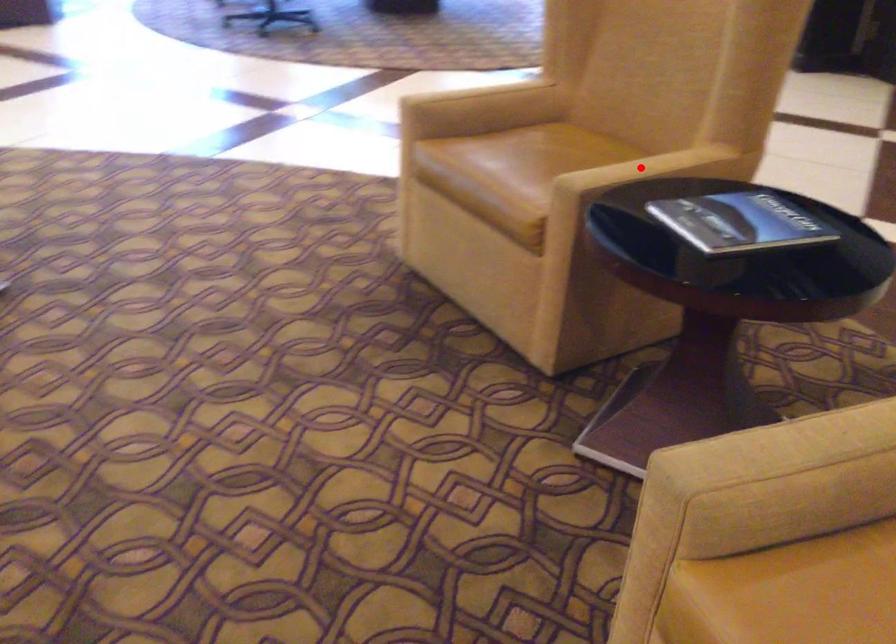
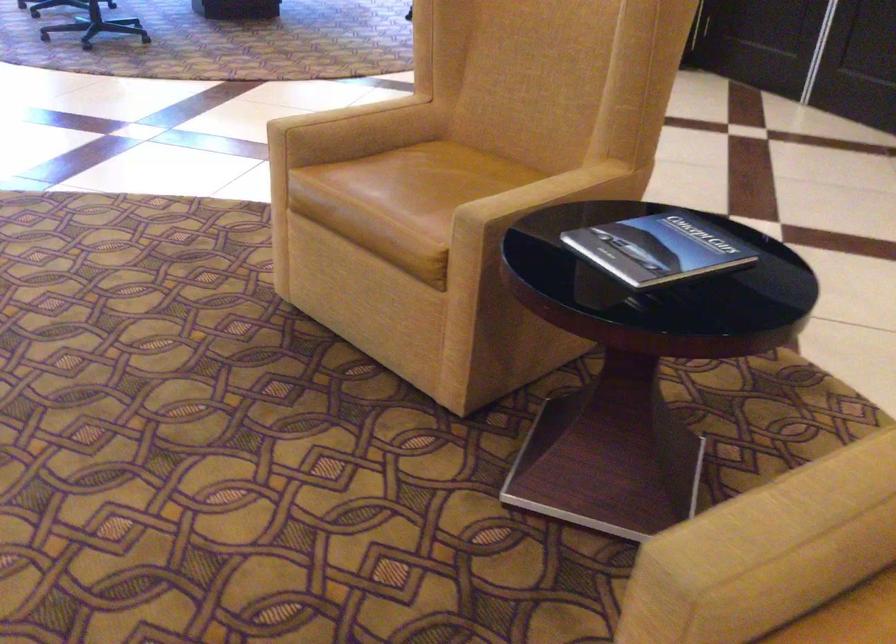
Locate, in the second image, the point that corresponds to the highlighted location in the first image.

(541, 193)